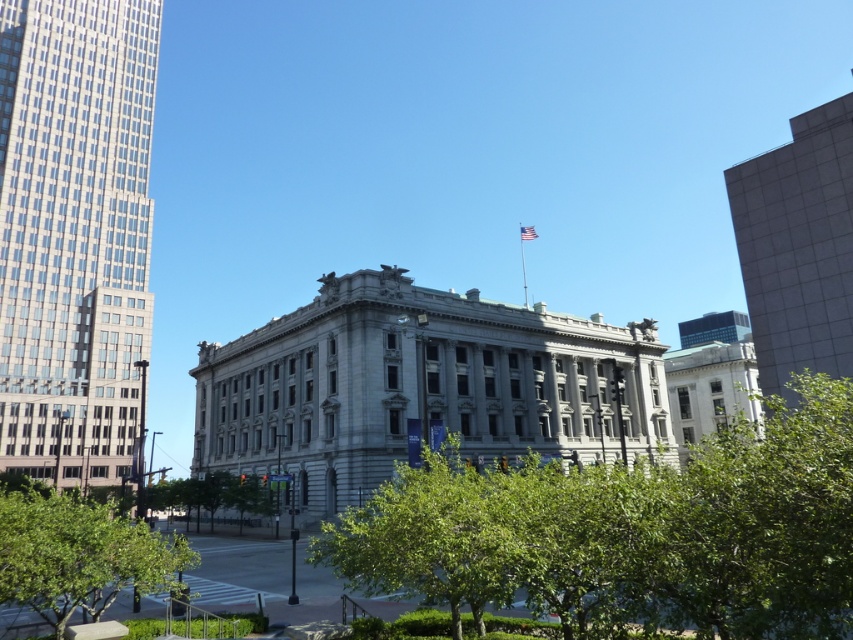
Question: Which point is closer to the camera taking this photo?

Choices:
 (A) (100, 584)
 (B) (196, 522)
 (C) (16, 202)
 (D) (608, 611)

Answer: (D)

Question: Among these points, which one is farthest from the camera?

Choices:
 (A) (x=424, y=531)
 (B) (x=115, y=166)

Answer: (B)

Question: Which point is closer to the camera taking this photo?

Choices:
 (A) [x=99, y=364]
 (B) [x=724, y=182]
 (C) [x=834, y=429]

Answer: (C)

Question: Is green leafy tree at lower left positioned in front of green leafy tree at lower center?

Choices:
 (A) no
 (B) yes

Answer: (B)

Question: Is the position of green leafy tree at center less distant than that of smooth gray building at right?

Choices:
 (A) no
 (B) yes

Answer: (B)

Question: Observing the image, what is the correct spatial positioning of green leafy tree at center in reference to green leafy tree at lower center?

Choices:
 (A) below
 (B) above

Answer: (B)